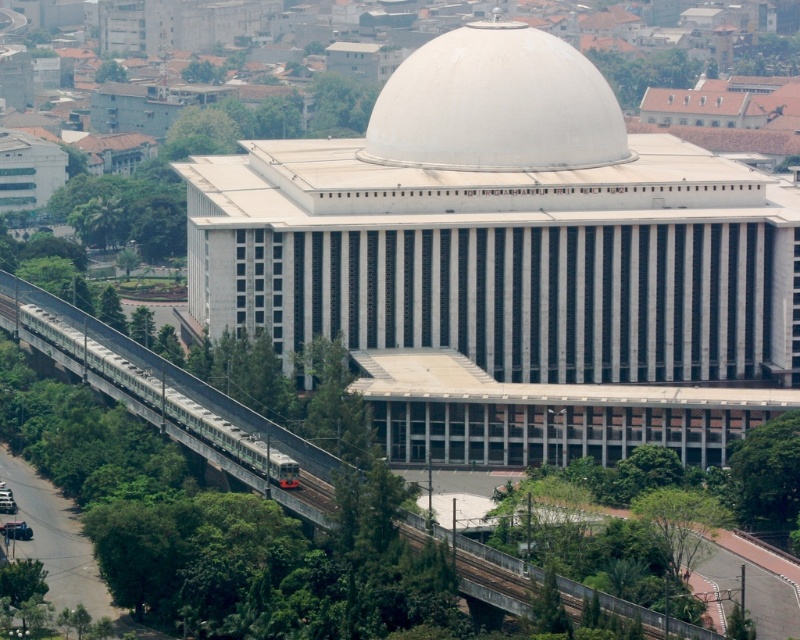
Question: Can you confirm if white smooth dome at center is wider than metallic gray train track at center?

Choices:
 (A) yes
 (B) no

Answer: (B)

Question: Which object appears closest to the camera in this image?

Choices:
 (A) metallic gray train track at center
 (B) white smooth dome at center

Answer: (A)

Question: Which point appears closest to the camera in this image?

Choices:
 (A) (396, 72)
 (B) (324, 467)

Answer: (B)

Question: Can you confirm if white smooth dome at center is positioned below metallic gray train track at center?

Choices:
 (A) no
 (B) yes

Answer: (A)

Question: Which point appears farthest from the camera in this image?

Choices:
 (A) pyautogui.click(x=560, y=129)
 (B) pyautogui.click(x=17, y=326)

Answer: (B)

Question: Can you confirm if white smooth dome at center is bigger than metallic gray train track at center?

Choices:
 (A) no
 (B) yes

Answer: (A)